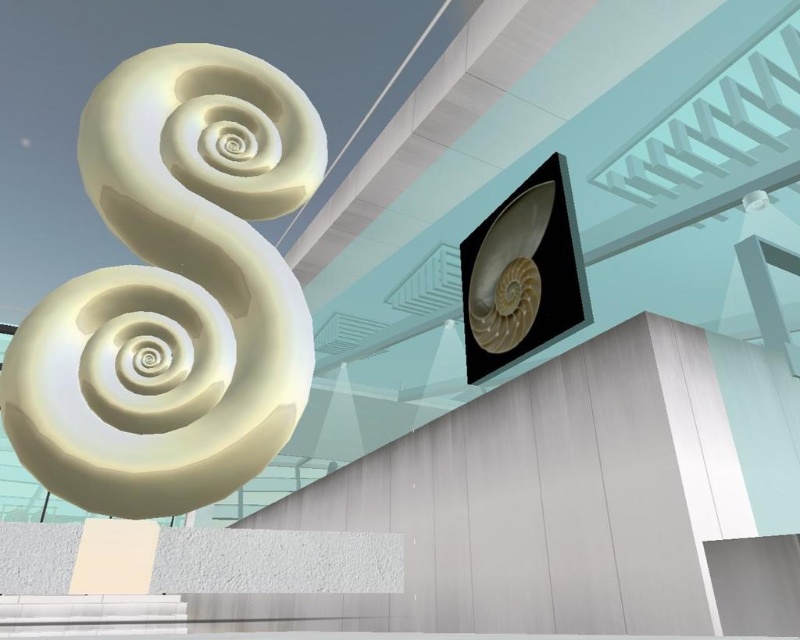
You are an architect designing a new sculpture garden. You have two sculptures to place in the garden. The first is the white glossy sculpture at upper left, and the second is the matte white shell at upper right. Based on their sizes, which sculpture would require more horizontal space in the garden?

The white glossy sculpture at upper left might be wider than matte white shell at upper right, so it would require more horizontal space in the garden.

You are an architect designing a new sculpture garden. You have two white sculptures to place in the garden. The white glossy sculpture at upper left and the matte white shell at upper right. If you want to create a visual hierarchy where the taller sculpture is placed in the foreground, which sculpture should you choose for the foreground?

The white glossy sculpture at upper left is taller than the matte white shell at upper right, so you should place the white glossy sculpture at upper left in the foreground to create the desired visual hierarchy.

You are an architect designing a garden layout and want to place a new statue between the white glossy sculpture at upper left and the matte white shell at upper right. Based on their positions, where should you place the statue to ensure it is equidistant from both objects?

The white glossy sculpture at upper left is to the left of matte white shell at upper right, so placing the statue exactly halfway between them along the horizontal axis would ensure it is equidistant from both objects.